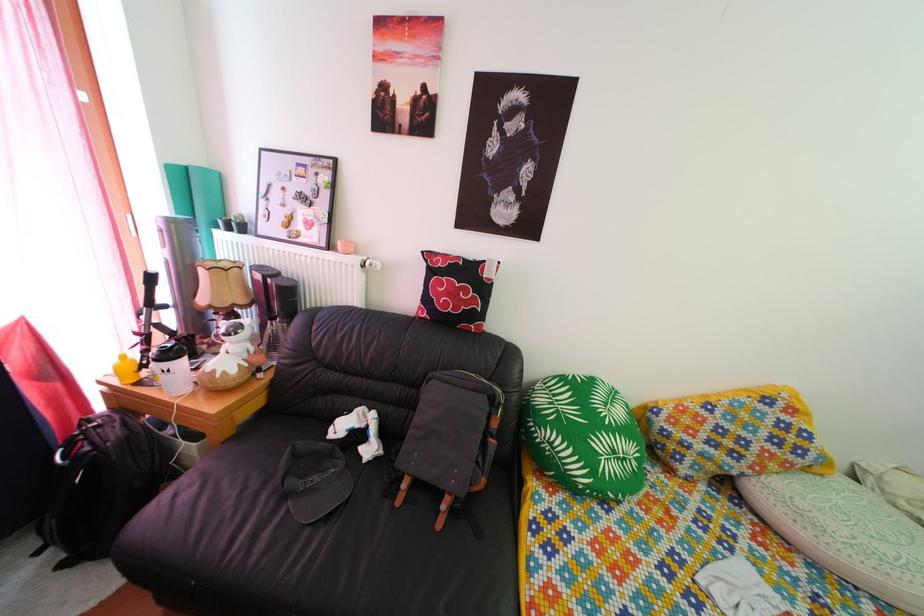
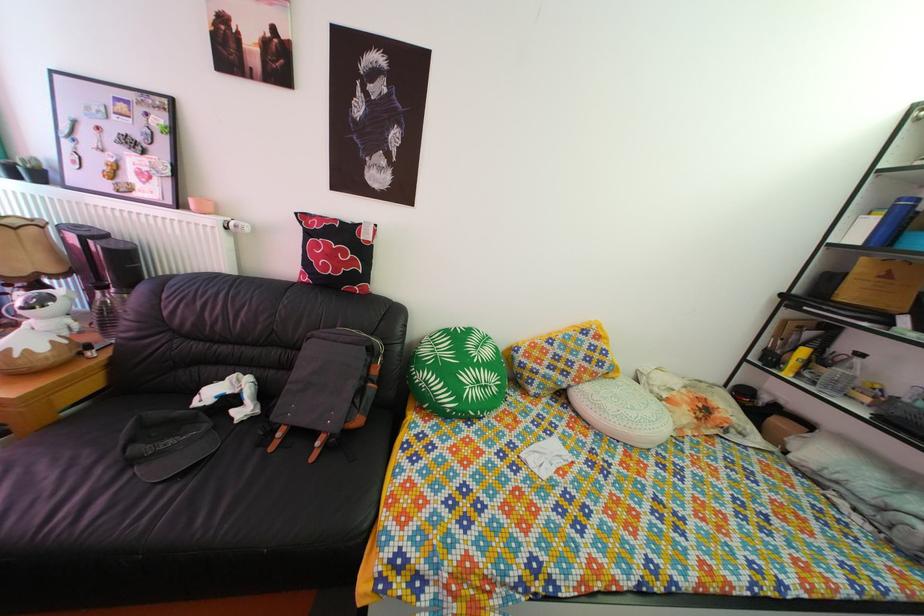
Locate, in the second image, the point that corresponds to (x=275, y=325) in the first image.

(103, 294)